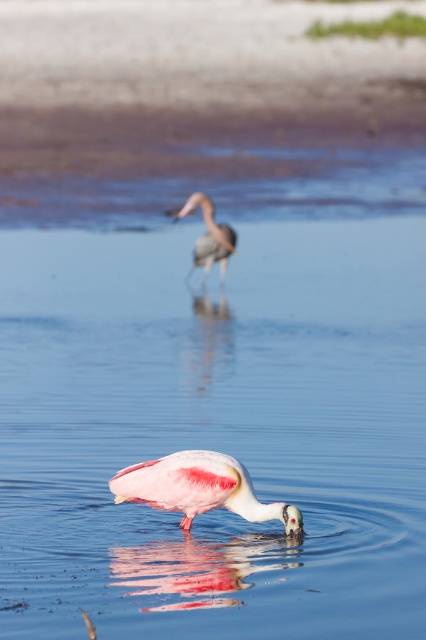
Question: Is pink matte spoonbill at center closer to the viewer compared to pink matte bird at center?

Choices:
 (A) no
 (B) yes

Answer: (B)

Question: Which object appears farthest from the camera in this image?

Choices:
 (A) pink matte spoonbill at center
 (B) pink matte bird at center

Answer: (B)

Question: From the image, what is the correct spatial relationship of pink matte spoonbill at center in relation to pink matte bird at center?

Choices:
 (A) right
 (B) left

Answer: (A)

Question: Observing the image, what is the correct spatial positioning of pink matte spoonbill at center in reference to pink matte bird at center?

Choices:
 (A) above
 (B) below

Answer: (B)